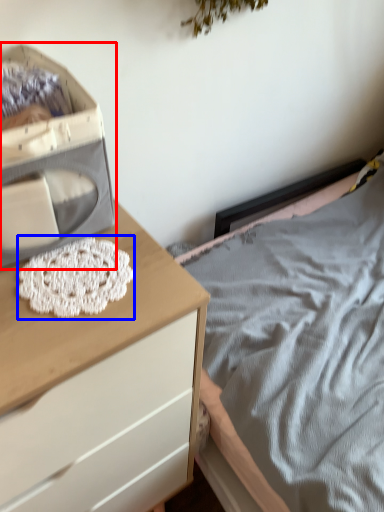
Question: Which point is closer to the camera, storage box (highlighted by a red box) or lace (highlighted by a blue box)?

Choices:
 (A) storage box
 (B) lace

Answer: (A)